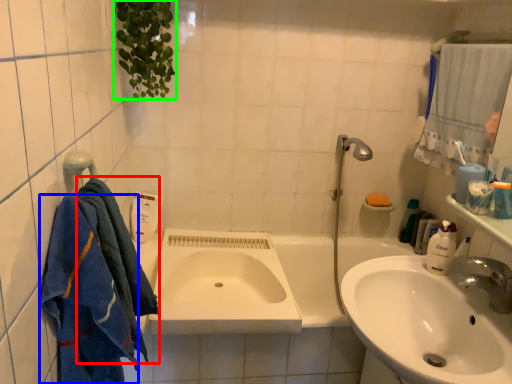
Question: Based on their relative distances, which object is nearer to bath towel (highlighted by a red box)? Choose from bath towel (highlighted by a blue box) and plant (highlighted by a green box).

Choices:
 (A) bath towel
 (B) plant

Answer: (A)